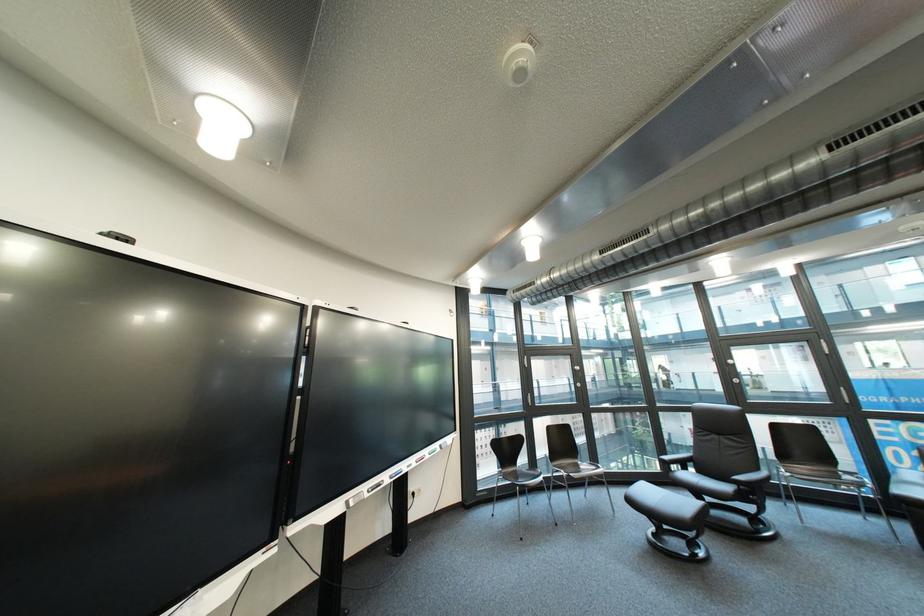
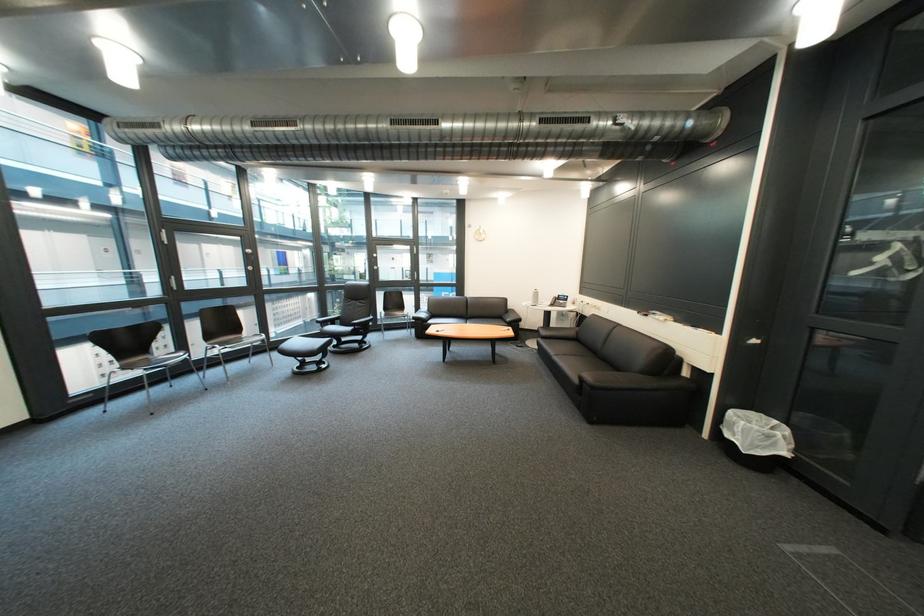
Locate, in the second image, the point that corresponds to (x=576, y=472) in the first image.

(229, 347)